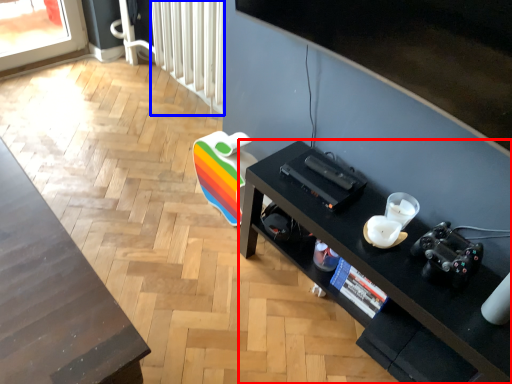
Question: Which object is closer to the camera taking this photo, desk (highlighted by a red box) or radiator (highlighted by a blue box)?

Choices:
 (A) desk
 (B) radiator

Answer: (A)